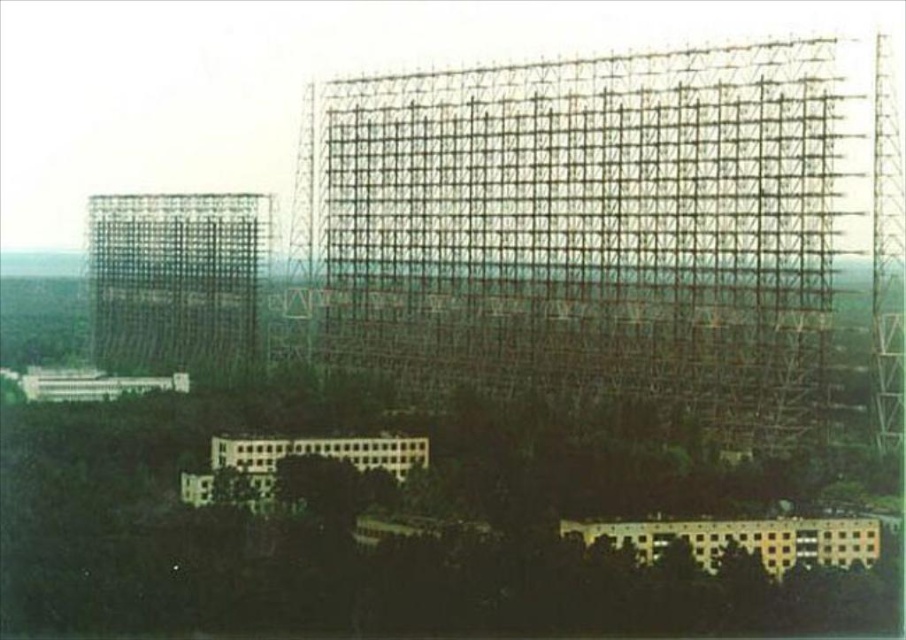
Is metallic grid structure at center to the right of metallic grid structure at left from the viewer's perspective?

Correct, you'll find metallic grid structure at center to the right of metallic grid structure at left.

Is point (388, 257) closer to camera compared to point (206, 268)?

That is True.

Identify the location of metallic grid structure at center. The width and height of the screenshot is (906, 640). (585, 228).